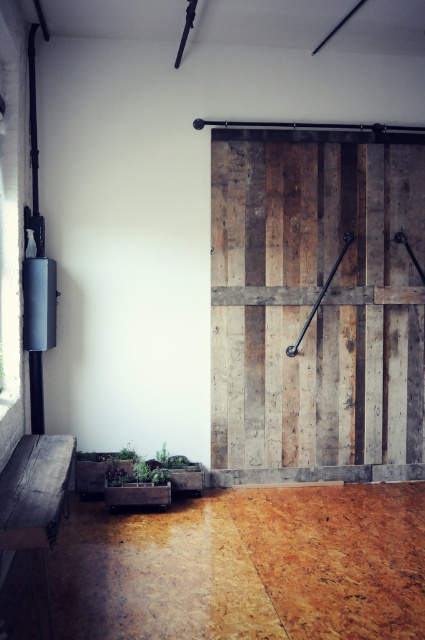
You are standing in the room and want to sit on the wooden bench at lower left. Can you walk directly to it without moving the weathered wood barn door at center?

The wooden bench at lower left is behind the weathered wood barn door at center, so you would need to move the door to access it directly.

You are an interior designer planning to place a new sofa in the room. The sofa is the same size as the wooden bench at lower left. Can the sofa fit in the space where the weathered wood barn door at center is currently located?

The weathered wood barn door at center is bigger than the wooden bench at lower left. Since the sofa is the same size as the wooden bench at lower left, it would be smaller than the space occupied by the barn door. Therefore, the sofa can fit in that location.

You are a furniture designer who wants to place a new shelf on the wall between the weathered wood barn door at center and the wooden bench at lower left. The shelf must be shorter than both objects. Can you confirm if this is possible?

The weathered wood barn door at center is taller than the wooden bench at lower left. Since the shelf needs to be shorter than both, the maximum height for the shelf would be shorter than the wooden bench at lower left, which is the shorter object. This is feasible as long as the shelf is designed to be shorter than the bench.